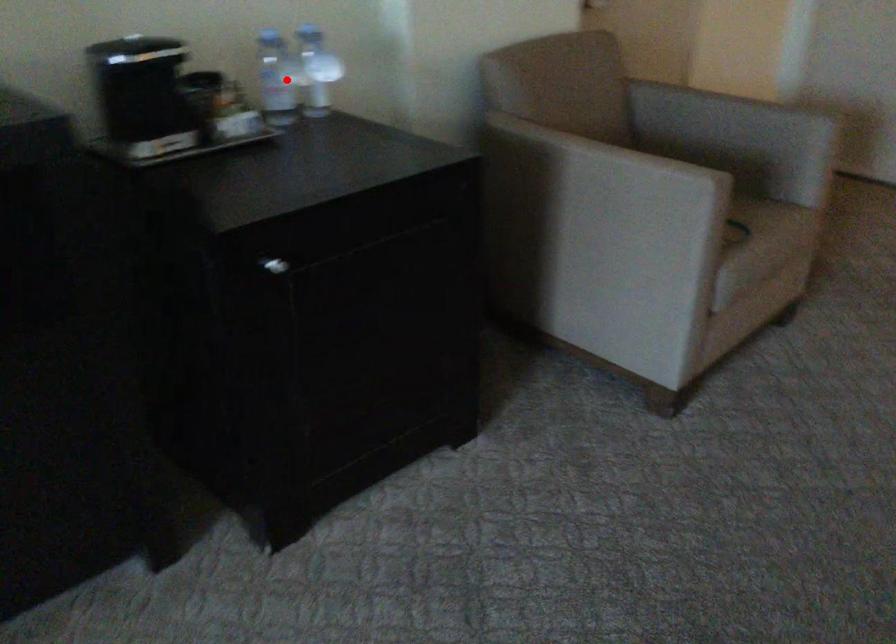
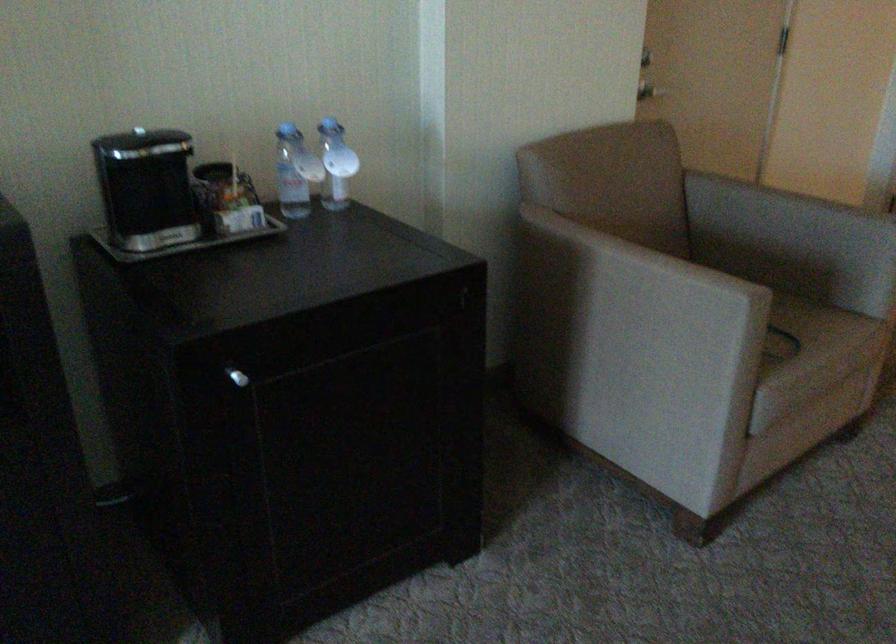
In the second image, find the point that corresponds to the highlighted location in the first image.

(295, 172)